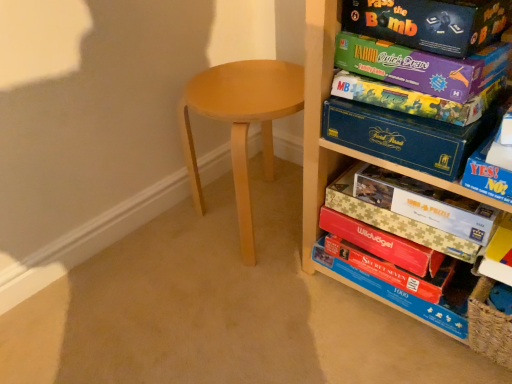
Question: Does blue cardboard box at right appear on the right side of red matte puzzle box at lower right, the 6th paperback book in the top-to-bottom sequence?

Choices:
 (A) yes
 (B) no

Answer: (A)

Question: Considering the relative sizes of blue cardboard box at right and red matte puzzle box at lower right, the 1th paperback book from the bottom, in the image provided, is blue cardboard box at right smaller than red matte puzzle box at lower right, the 1th paperback book from the bottom,?

Choices:
 (A) yes
 (B) no

Answer: (B)

Question: Is blue cardboard box at right behind red matte puzzle box at lower right, the 6th paperback book in the top-to-bottom sequence?

Choices:
 (A) yes
 (B) no

Answer: (B)

Question: Is blue cardboard box at right wider than red matte puzzle box at lower right, the 6th paperback book in the top-to-bottom sequence?

Choices:
 (A) no
 (B) yes

Answer: (B)

Question: Is blue cardboard box at right at the left side of red matte puzzle box at lower right, the 6th paperback book in the top-to-bottom sequence?

Choices:
 (A) yes
 (B) no

Answer: (B)

Question: Could red matte puzzle box at lower right, the 1th paperback book from the bottom, be considered to be inside blue cardboard box at right?

Choices:
 (A) yes
 (B) no

Answer: (B)

Question: Considering the relative sizes of blue cardboard box at right, which appears as the fourth paperback book when viewed from the top, and beige cardboard puzzle at center-right, the 5th paperback book viewed from the top, in the image provided, is blue cardboard box at right, which appears as the fourth paperback book when viewed from the top, wider than beige cardboard puzzle at center-right, the 5th paperback book viewed from the top,?

Choices:
 (A) no
 (B) yes

Answer: (A)

Question: Is blue cardboard box at right, which appears as the fourth paperback book when viewed from the top, directly adjacent to beige cardboard puzzle at center-right, the 2th paperback book from the bottom?

Choices:
 (A) yes
 (B) no

Answer: (B)

Question: Is blue cardboard box at right, which appears as the fourth paperback book when viewed from the top, positioned before beige cardboard puzzle at center-right, the 2th paperback book from the bottom?

Choices:
 (A) no
 (B) yes

Answer: (B)

Question: Can you confirm if blue cardboard box at right, which ranks as the 3th paperback book in bottom-to-top order, is smaller than beige cardboard puzzle at center-right, the 5th paperback book viewed from the top?

Choices:
 (A) yes
 (B) no

Answer: (A)

Question: Considering the relative sizes of blue cardboard box at right, which ranks as the 3th paperback book in bottom-to-top order, and beige cardboard puzzle at center-right, the 2th paperback book from the bottom, in the image provided, is blue cardboard box at right, which ranks as the 3th paperback book in bottom-to-top order, taller than beige cardboard puzzle at center-right, the 2th paperback book from the bottom,?

Choices:
 (A) yes
 (B) no

Answer: (A)

Question: Does blue cardboard box at right, which appears as the fourth paperback book when viewed from the top, have a lesser height compared to beige cardboard puzzle at center-right, the 2th paperback book from the bottom?

Choices:
 (A) no
 (B) yes

Answer: (A)

Question: Is red matte puzzle box at lower right, the 1th paperback book from the bottom, smaller than blue cardboard box at right?

Choices:
 (A) yes
 (B) no

Answer: (A)